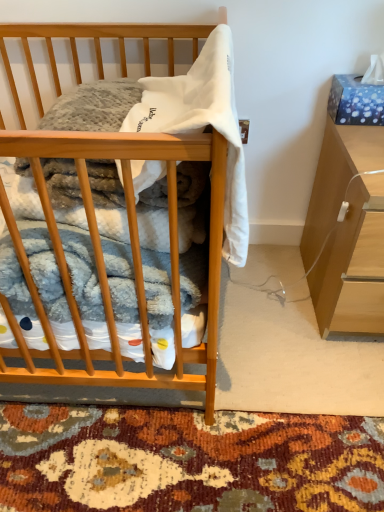
Question: Is light brown wood cabinet at right wider than wooden desk at center?

Choices:
 (A) no
 (B) yes

Answer: (A)

Question: From the image's perspective, is light brown wood cabinet at right on top of wooden desk at center?

Choices:
 (A) no
 (B) yes

Answer: (A)

Question: Is light brown wood cabinet at right at the right side of wooden desk at center?

Choices:
 (A) yes
 (B) no

Answer: (A)

Question: Is light brown wood cabinet at right positioned with its back to wooden desk at center?

Choices:
 (A) yes
 (B) no

Answer: (B)

Question: From the image's perspective, is light brown wood cabinet at right below wooden desk at center?

Choices:
 (A) no
 (B) yes

Answer: (B)

Question: Is light brown wood cabinet at right beside wooden desk at center?

Choices:
 (A) yes
 (B) no

Answer: (B)

Question: Does white soft fabric at center have a greater height compared to light brown wood cabinet at right?

Choices:
 (A) yes
 (B) no

Answer: (B)

Question: Is the depth of white soft fabric at center greater than that of light brown wood cabinet at right?

Choices:
 (A) no
 (B) yes

Answer: (A)

Question: Is white soft fabric at center not within light brown wood cabinet at right?

Choices:
 (A) yes
 (B) no

Answer: (A)

Question: Is white soft fabric at center smaller than light brown wood cabinet at right?

Choices:
 (A) no
 (B) yes

Answer: (B)

Question: Is white soft fabric at center bigger than light brown wood cabinet at right?

Choices:
 (A) no
 (B) yes

Answer: (A)

Question: Does white soft fabric at center have a lesser width compared to light brown wood cabinet at right?

Choices:
 (A) no
 (B) yes

Answer: (B)

Question: Can you confirm if wooden desk at center is wider than white soft fabric at center?

Choices:
 (A) yes
 (B) no

Answer: (A)